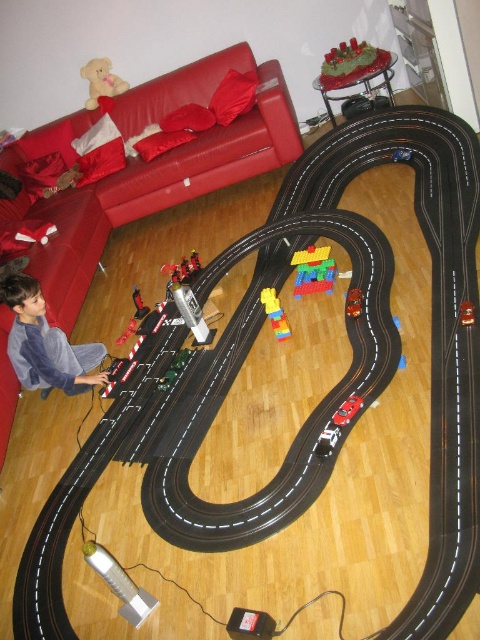
Is translucent plastic car at center to the left of rubber car at center from the viewer's perspective?

Yes, translucent plastic car at center is to the left of rubber car at center.

Measure the distance between point (349, 292) and camera.

Point (349, 292) and camera are 2.79 meters apart from each other.

What do you see at coordinates (354, 301) in the screenshot? Image resolution: width=480 pixels, height=640 pixels. I see `translucent plastic car at center` at bounding box center [354, 301].

Find the location of `translucent plastic car at center`. translucent plastic car at center is located at coordinates (354, 301).

What do you see at coordinates (46, 342) in the screenshot?
I see `gray cotton shirt at lower left` at bounding box center [46, 342].

Between gray cotton shirt at lower left and fuzzy beige teddy bear at upper left, which one appears on the right side from the viewer's perspective?

Positioned to the right is gray cotton shirt at lower left.

This screenshot has height=640, width=480. What do you see at coordinates (46, 342) in the screenshot?
I see `gray cotton shirt at lower left` at bounding box center [46, 342].

The image size is (480, 640). Identify the location of gray cotton shirt at lower left. point(46,342).

Does green velvet cake at upper center appear over metallic red car at lower left?

Yes.

Does point (337, 65) come closer to viewer compared to point (127, 333)?

No, it is not.

Where is `green velvet cake at upper center`? Image resolution: width=480 pixels, height=640 pixels. green velvet cake at upper center is located at coordinates (350, 64).